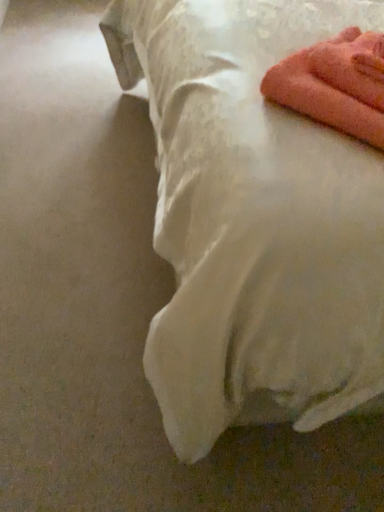
Question: Considering the positions of pink fluffy towel at upper right and white satin bed at upper right in the image, is pink fluffy towel at upper right taller or shorter than white satin bed at upper right?

Choices:
 (A) tall
 (B) short

Answer: (B)

Question: Considering the positions of point (327, 47) and point (278, 414), is point (327, 47) closer or farther from the camera than point (278, 414)?

Choices:
 (A) closer
 (B) farther

Answer: (A)

Question: Considering their positions, is pink fluffy towel at upper right located in front of or behind white satin bed at upper right?

Choices:
 (A) behind
 (B) front

Answer: (A)

Question: Relative to pink fluffy towel at upper right, is white satin bed at upper right in front or behind?

Choices:
 (A) front
 (B) behind

Answer: (A)

Question: Is point (210, 448) positioned closer to the camera than point (379, 138)?

Choices:
 (A) closer
 (B) farther

Answer: (B)

Question: Would you say white satin bed at upper right is inside or outside pink fluffy towel at upper right?

Choices:
 (A) inside
 (B) outside

Answer: (B)

Question: From the image's perspective, is white satin bed at upper right above or below pink fluffy towel at upper right?

Choices:
 (A) above
 (B) below

Answer: (A)